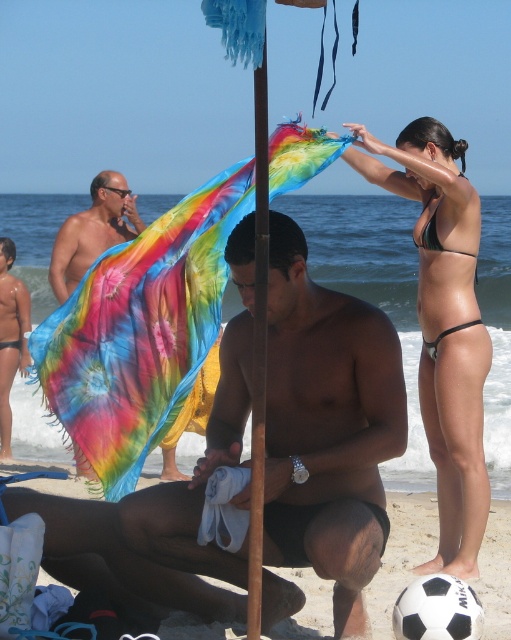
Question: Does green and black bikini at upper right have a lesser width compared to multicolored tie-dye towel at left?

Choices:
 (A) no
 (B) yes

Answer: (A)

Question: Does black matte soccer ball at lower center appear on the left side of matte black skin at lower left?

Choices:
 (A) no
 (B) yes

Answer: (A)

Question: Based on their relative distances, which object is farther from the smooth tan skin at center?

Choices:
 (A) wooden pole at center
 (B) black matte soccer ball at lower center

Answer: (B)

Question: Which object is positioned closest to the black matte bikini at right?

Choices:
 (A) smooth tan skin at center
 (B) black matte soccer ball at lower center
 (C) multicolored tie-dye towel at left

Answer: (A)

Question: Can you confirm if smooth tan skin at center is positioned below black matte soccer ball at lower center?

Choices:
 (A) no
 (B) yes

Answer: (A)

Question: Which point appears closest to the camera in this image?

Choices:
 (A) (429, 248)
 (B) (261, 422)

Answer: (B)